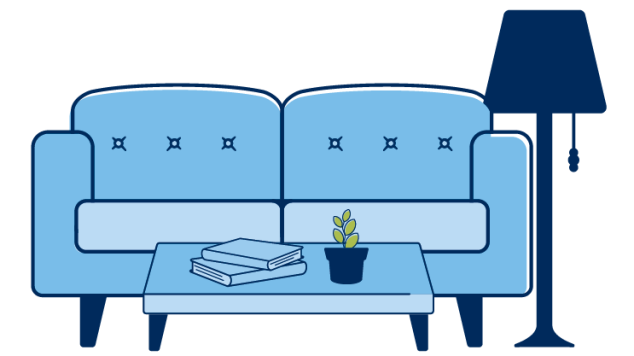
At what (x,y) coordinates should I click in order to perform the action: click on cushion. Please return your answer as a coordinate pair (x, y). This screenshot has width=634, height=356. Looking at the image, I should click on (126, 229).